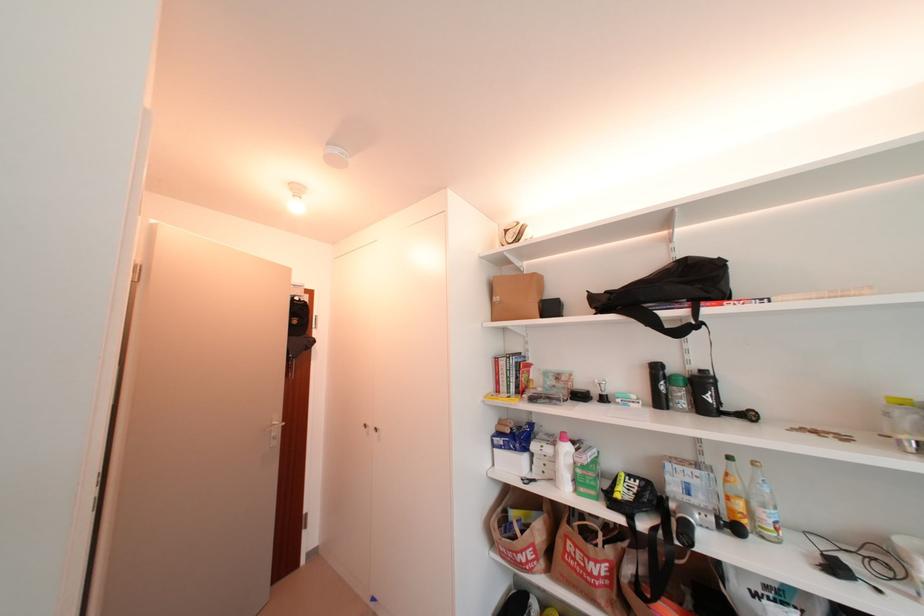
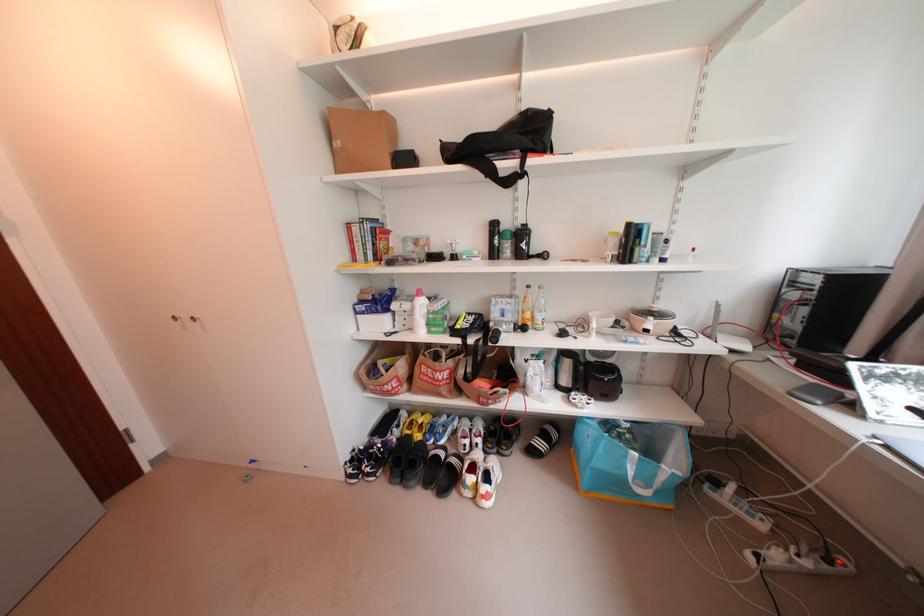
In the second image, find the point that corresponds to pixel 740 480 in the first image.

(536, 301)